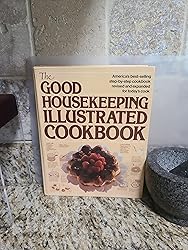
I want to click on cookbook, so click(x=114, y=125).